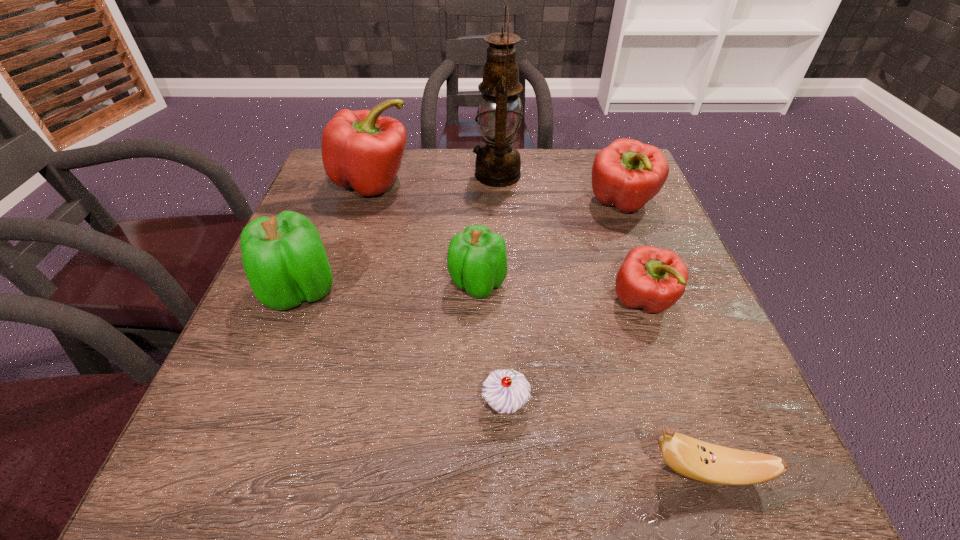
Where is `vacant region between the tallest object and the second smallest pink bell pepper`? vacant region between the tallest object and the second smallest pink bell pepper is located at coordinates (560, 190).

This screenshot has height=540, width=960. I want to click on unoccupied area between the biggest pink bell pepper and the nearest pink bell pepper, so click(508, 242).

Locate an element on the screen. This screenshot has width=960, height=540. free spot between the second biggest pink bell pepper and the brown oil lamp is located at coordinates (560, 190).

Locate an element on the screen. This screenshot has width=960, height=540. free spot between the bigger green bell pepper and the third bell pepper from right to left is located at coordinates (389, 287).

Locate an element on the screen. Image resolution: width=960 pixels, height=540 pixels. free space between the leftmost pink bell pepper and the smallest pink bell pepper is located at coordinates (508, 242).

The width and height of the screenshot is (960, 540). I want to click on free spot between the smaller green bell pepper and the second nearest object, so click(x=492, y=343).

Locate an element on the screen. vacant space that is in between the yellow banana and the biggest pink bell pepper is located at coordinates (540, 327).

In order to click on empty location between the cupcake and the smallest pink bell pepper in this screenshot , I will do `click(574, 353)`.

Select which object is the closest to the smallest pink bell pepper. Please provide its 2D coordinates. Your answer should be formatted as a tuple, i.e. [(x, y)], where the tuple contains the x and y coordinates of a point satisfying the conditions above.

[(627, 174)]

Find the location of a particular element. The image size is (960, 540). object that is the sixth closest to the brown oil lamp is located at coordinates (506, 391).